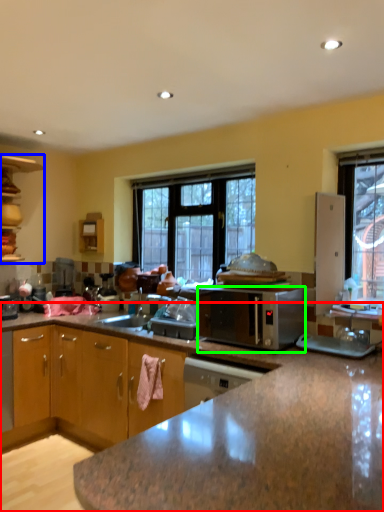
Question: Based on their relative distances, which object is nearer to cabinetry (highlighted by a red box)? Choose from cabinetry (highlighted by a blue box) and microwave oven (highlighted by a green box).

Choices:
 (A) cabinetry
 (B) microwave oven

Answer: (B)